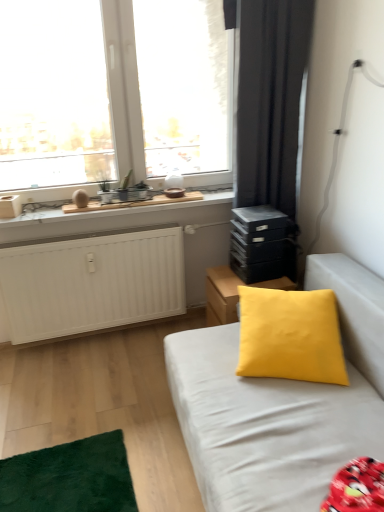
This screenshot has height=512, width=384. Describe the element at coordinates (290, 335) in the screenshot. I see `matte yellow pillow at center` at that location.

Describe the element at coordinates (154, 99) in the screenshot. I see `transparent glass window at upper left` at that location.

Image resolution: width=384 pixels, height=512 pixels. What are the coordinates of `transparent glass window at upper left` in the screenshot? It's located at (154, 99).

Describe the element at coordinates (270, 100) in the screenshot. I see `black matte curtain at upper right` at that location.

This screenshot has height=512, width=384. Describe the element at coordinates (262, 244) in the screenshot. I see `black matte stack of drawers at right` at that location.

The image size is (384, 512). What do you see at coordinates (222, 295) in the screenshot?
I see `yellow fabric cushion at center` at bounding box center [222, 295].

Identify the location of matte yellow pillow at center. The height and width of the screenshot is (512, 384). (290, 335).

This screenshot has height=512, width=384. I want to click on pillow on the left of black matte curtain at upper right, so click(x=290, y=335).

Considering the positions of objects matte yellow pillow at center and black matte curtain at upper right in the image provided, who is in front, matte yellow pillow at center or black matte curtain at upper right?

matte yellow pillow at center is in front.

From the image's perspective, is matte yellow pillow at center above black matte curtain at upper right?

Actually, matte yellow pillow at center appears below black matte curtain at upper right in the image.

Is matte yellow pillow at center in contact with black matte curtain at upper right?

matte yellow pillow at center is not next to black matte curtain at upper right, and they're not touching.

Between matte yellow pillow at center and transparent glass window at upper left, which one has more height?

transparent glass window at upper left is taller.

From the image's perspective, is matte yellow pillow at center above or below transparent glass window at upper left?

matte yellow pillow at center is situated lower than transparent glass window at upper left in the image.

Does matte yellow pillow at center turn towards transparent glass window at upper left?

No, matte yellow pillow at center is not facing towards transparent glass window at upper left.

Is there a large distance between matte yellow pillow at center and transparent glass window at upper left?

Absolutely, matte yellow pillow at center is distant from transparent glass window at upper left.

From the image's perspective, which one is positioned higher, black matte curtain at upper right or black matte stack of drawers at right?

black matte curtain at upper right is shown above in the image.

What are the coordinates of `dresser behind the black matte curtain at upper right` in the screenshot? It's located at (262, 244).

Between black matte curtain at upper right and black matte stack of drawers at right, which one has smaller width?

Thinner between the two is black matte stack of drawers at right.

Considering the relative positions of black matte curtain at upper right and black matte stack of drawers at right in the image provided, is black matte curtain at upper right to the left or to the right of black matte stack of drawers at right?

Clearly, black matte curtain at upper right is on the right of black matte stack of drawers at right in the image.

Is yellow fabric cushion at center facing towards black matte stack of drawers at right?

No, yellow fabric cushion at center is not facing towards black matte stack of drawers at right.

From the image's perspective, which one is positioned higher, yellow fabric cushion at center or black matte stack of drawers at right?

black matte stack of drawers at right.

Is yellow fabric cushion at center positioned before black matte stack of drawers at right?

No, yellow fabric cushion at center is further to the viewer.

Is yellow fabric cushion at center inside or outside of black matte stack of drawers at right?

yellow fabric cushion at center is outside black matte stack of drawers at right.

From a real-world perspective, is transparent glass window at upper left beneath yellow matte pillow at center?

No.

Is yellow matte pillow at center completely or partially inside transparent glass window at upper left?

No, transparent glass window at upper left does not contain yellow matte pillow at center.

Which of these two, transparent glass window at upper left or yellow matte pillow at center, is wider?

With larger width is yellow matte pillow at center.

Is yellow matte pillow at center smaller than black matte stack of drawers at right?

Incorrect, yellow matte pillow at center is not smaller in size than black matte stack of drawers at right.

Is yellow matte pillow at center next to black matte stack of drawers at right?

No, yellow matte pillow at center is not touching black matte stack of drawers at right.

Between yellow matte pillow at center and black matte stack of drawers at right, which one has more height?

yellow matte pillow at center.

From the image's perspective, which object appears higher, yellow matte pillow at center or black matte stack of drawers at right?

black matte stack of drawers at right, from the image's perspective.

Does point (232, 260) come in front of point (223, 68)?

Yes, it is.

Is black matte stack of drawers at right bigger or smaller than transparent glass window at upper left?

In the image, black matte stack of drawers at right appears to be smaller than transparent glass window at upper left.

Considering their positions, is black matte stack of drawers at right located in front of or behind transparent glass window at upper left?

black matte stack of drawers at right is behind transparent glass window at upper left.

Identify the location of window located above the black matte stack of drawers at right (from a real-world perspective). The image size is (384, 512). (154, 99).

I want to click on curtain behind the matte yellow pillow at center, so click(x=270, y=100).

This screenshot has width=384, height=512. I want to click on window above the matte yellow pillow at center (from a real-world perspective), so click(154, 99).

Considering their positions, is matte yellow pillow at center positioned closer to black matte curtain at upper right than black matte stack of drawers at right?

Based on the image, black matte stack of drawers at right appears to be nearer to black matte curtain at upper right.

Considering their positions, is black matte stack of drawers at right positioned closer to yellow matte pillow at center than yellow fabric cushion at center?

yellow fabric cushion at center is positioned closer to the anchor yellow matte pillow at center.

From the image, which object appears to be farther from yellow matte pillow at center, matte yellow pillow at center or yellow fabric cushion at center?

Among the two, yellow fabric cushion at center is located further to yellow matte pillow at center.

When comparing their distances from matte yellow pillow at center, does black matte curtain at upper right or transparent glass window at upper left seem further?

transparent glass window at upper left lies further to matte yellow pillow at center than the other object.

Considering their positions, is matte yellow pillow at center positioned closer to yellow fabric cushion at center than black matte curtain at upper right?

Based on the image, matte yellow pillow at center appears to be nearer to yellow fabric cushion at center.

Looking at the image, which one is located further to black matte curtain at upper right, black matte stack of drawers at right or yellow fabric cushion at center?

yellow fabric cushion at center is positioned further to the anchor black matte curtain at upper right.

Estimate the real-world distances between objects in this image. Which object is closer to matte yellow pillow at center, yellow fabric cushion at center or black matte curtain at upper right?

The object closer to matte yellow pillow at center is yellow fabric cushion at center.

Based on their spatial positions, is transparent glass window at upper left or yellow matte pillow at center further from black matte curtain at upper right?

Based on the image, yellow matte pillow at center appears to be further to black matte curtain at upper right.

At what (x,y) coordinates should I click in order to perform the action: click on window between yellow matte pillow at center and black matte stack of drawers at right from front to back. Please return your answer as a coordinate pair (x, y). Looking at the image, I should click on (154, 99).

At what (x,y) coordinates should I click in order to perform the action: click on dresser between yellow matte pillow at center and yellow fabric cushion at center in the front-back direction. Please return your answer as a coordinate pair (x, y). The height and width of the screenshot is (512, 384). Looking at the image, I should click on (262, 244).

Find the location of `dresser that lies between black matte curtain at upper right and matte yellow pillow at center from top to bottom`. dresser that lies between black matte curtain at upper right and matte yellow pillow at center from top to bottom is located at coordinates 262,244.

This screenshot has width=384, height=512. In order to click on curtain between yellow matte pillow at center and yellow fabric cushion at center from front to back in this screenshot , I will do `click(270, 100)`.